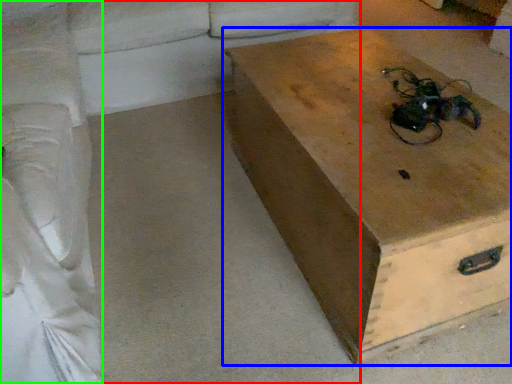
Question: Which is farther away from studio couch (highlighted by a red box)? box (highlighted by a blue box) or couch (highlighted by a green box)?

Choices:
 (A) box
 (B) couch

Answer: (A)